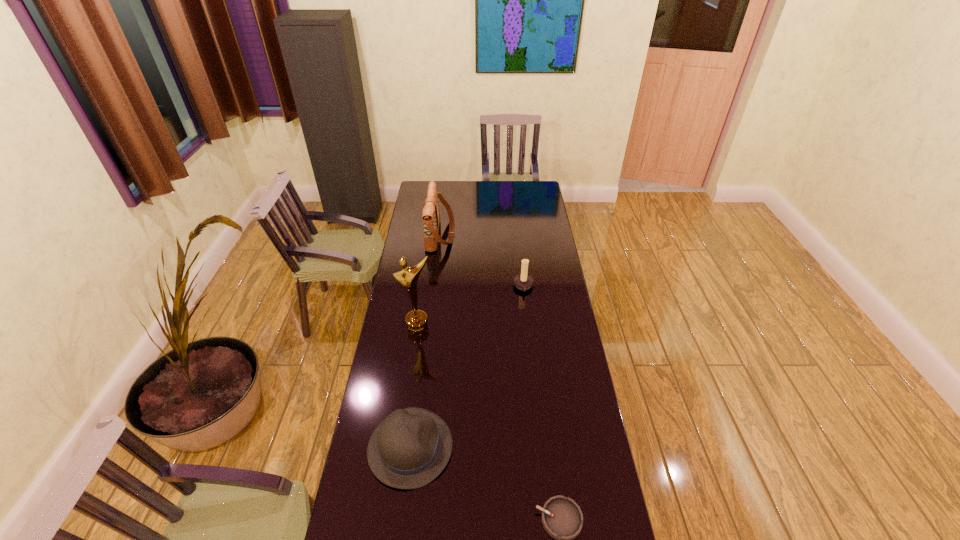
This screenshot has height=540, width=960. I want to click on the tallest object, so click(x=416, y=321).

Locate an element on the screen. The height and width of the screenshot is (540, 960). the third farthest object is located at coordinates (416, 321).

Locate an element on the screen. the farthest object is located at coordinates (431, 215).

At what (x,y) coordinates should I click in order to perform the action: click on the fourth shortest object. Please return your answer as a coordinate pair (x, y). Looking at the image, I should click on (431, 215).

I want to click on the second farthest object, so click(522, 281).

You are a GUI agent. You are given a task and a screenshot of the screen. Output one action in this format:
    pyautogui.click(x=<x>, y=<y>)
    Task: Click on the second nearest object
    
    Given the screenshot: What is the action you would take?
    pyautogui.click(x=410, y=448)

At what (x,y) coordinates should I click in order to perform the action: click on free spot located on the front-facing side of the third nearest object. Please return your answer as a coordinate pair (x, y). The width and height of the screenshot is (960, 540). Looking at the image, I should click on (414, 359).

Find the location of `free space located on the front-facing side of the fourth shortest object`. free space located on the front-facing side of the fourth shortest object is located at coordinates (490, 234).

The image size is (960, 540). Find the location of `blank space located 0.360m on the wick of the second farthest object`. blank space located 0.360m on the wick of the second farthest object is located at coordinates (438, 287).

Locate an element on the screen. free spot located on the wick of the second farthest object is located at coordinates (454, 287).